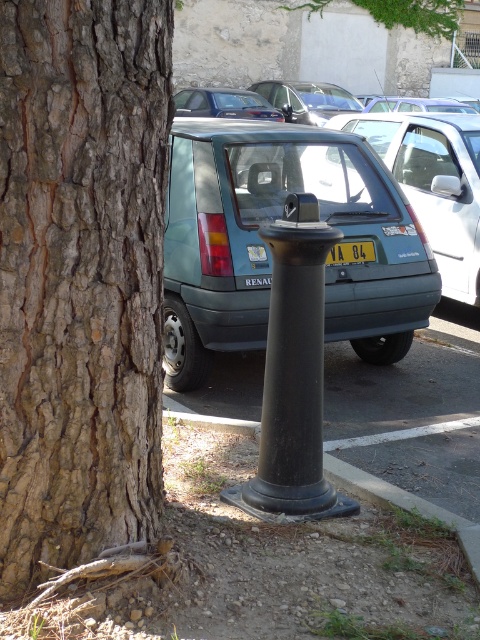
Does brown rough bark at left appear on the right side of teal matte hatchback at center?

No, brown rough bark at left is not to the right of teal matte hatchback at center.

Based on the photo, who is higher up, brown rough bark at left or teal matte hatchback at center?

teal matte hatchback at center

Which is in front, point (6, 531) or point (175, 353)?

Point (6, 531)

Locate an element on the screen. The height and width of the screenshot is (640, 480). brown rough bark at left is located at coordinates (81, 276).

Can you confirm if matte green car at center is thinner than yellow plastic license plate at center?

In fact, matte green car at center might be wider than yellow plastic license plate at center.

Locate an element on the screen. matte green car at center is located at coordinates (433, 182).

The width and height of the screenshot is (480, 640). Identify the location of black matte pole at center. (294, 376).